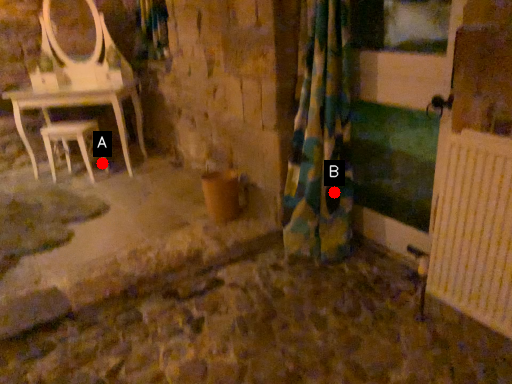
Question: Two points are circled on the image, labeled by A and B beside each circle. Among these points, which one is farthest from the camera?

Choices:
 (A) A is further
 (B) B is further

Answer: (A)